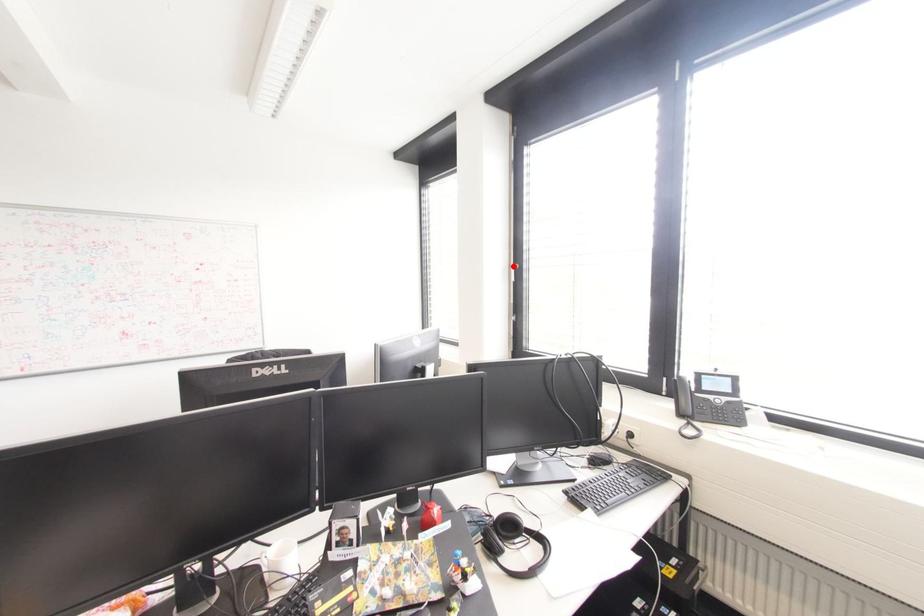
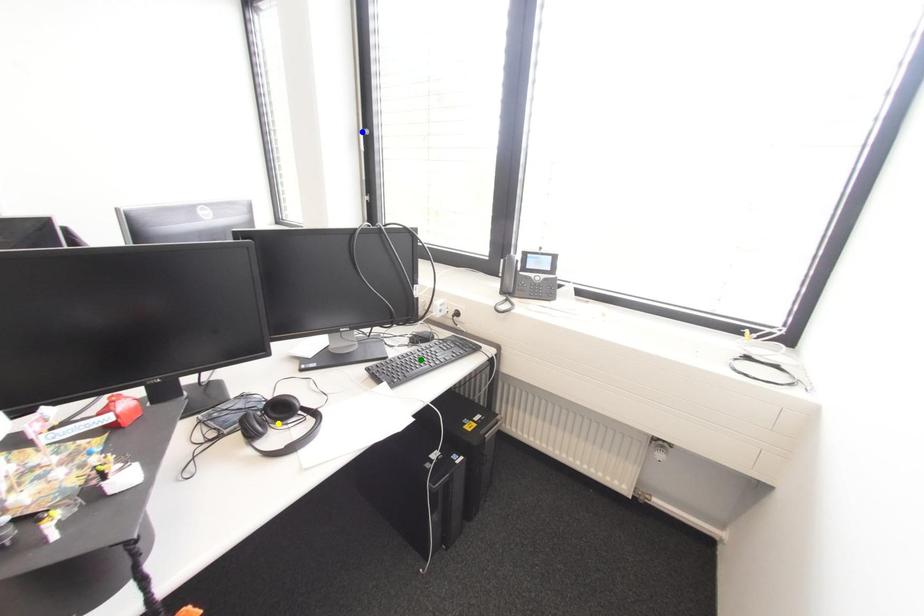
Question: I am providing you with two images of the same scene from different viewpoints. A red point is marked on the first image. You are given multiple points on the second image. Which point in image 2 is actually the same real-world point as the red point in image 1?

Choices:
 (A) blue point
 (B) green point
 (C) yellow point

Answer: (A)